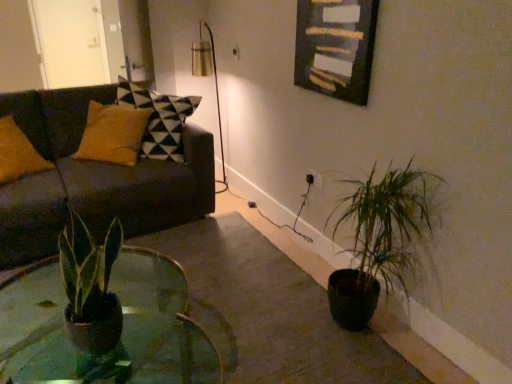
Question: Can you confirm if green matte plant at lower right is bigger than wooden frame at upper center?

Choices:
 (A) yes
 (B) no

Answer: (A)

Question: From a real-world perspective, does green matte plant at lower right stand above wooden frame at upper center?

Choices:
 (A) yes
 (B) no

Answer: (B)

Question: Considering the relative positions of green matte plant at lower right and wooden frame at upper center in the image provided, is green matte plant at lower right behind wooden frame at upper center?

Choices:
 (A) no
 (B) yes

Answer: (A)

Question: Is wooden frame at upper center located within green matte plant at lower right?

Choices:
 (A) yes
 (B) no

Answer: (B)

Question: From the image's perspective, is green matte plant at lower right over wooden frame at upper center?

Choices:
 (A) no
 (B) yes

Answer: (A)

Question: Is green matte plant at lower right not near wooden frame at upper center?

Choices:
 (A) no
 (B) yes

Answer: (A)

Question: Is wooden frame at upper center outside of green glass coffee table at center?

Choices:
 (A) no
 (B) yes

Answer: (B)

Question: From the image's perspective, is wooden frame at upper center located above green glass coffee table at center?

Choices:
 (A) yes
 (B) no

Answer: (A)

Question: Is wooden frame at upper center at the right side of green glass coffee table at center?

Choices:
 (A) yes
 (B) no

Answer: (A)

Question: Is wooden frame at upper center oriented away from green glass coffee table at center?

Choices:
 (A) yes
 (B) no

Answer: (B)

Question: From a real-world perspective, is wooden frame at upper center located higher than green glass coffee table at center?

Choices:
 (A) no
 (B) yes

Answer: (B)

Question: From the image's perspective, is wooden frame at upper center below green glass coffee table at center?

Choices:
 (A) no
 (B) yes

Answer: (A)

Question: Does white glossy door at upper left turn towards green matte plant at lower right?

Choices:
 (A) yes
 (B) no

Answer: (B)